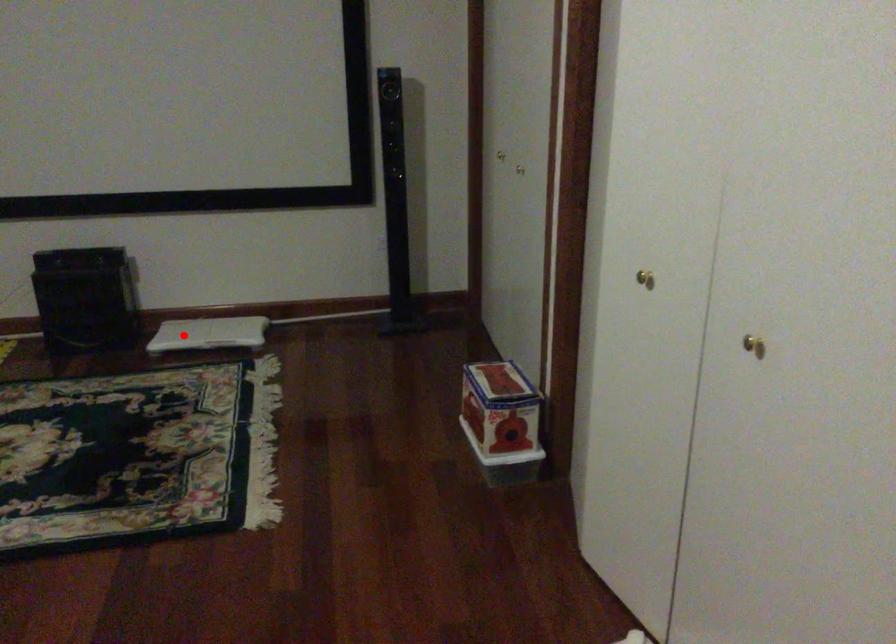
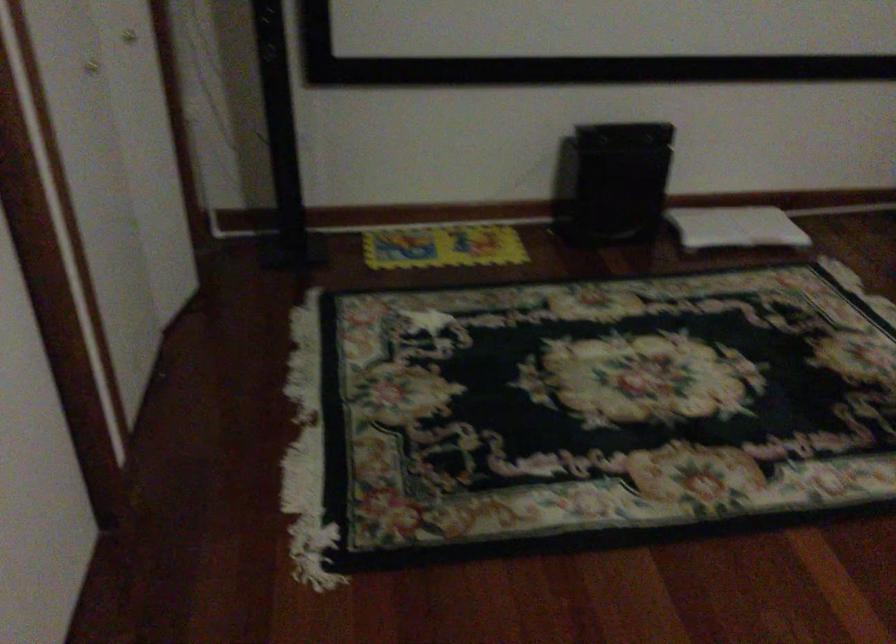
Question: A red point is marked in image1. In image2, is the corresponding 3D point closer to the camera or farther? Reply with the corresponding letter.

Choices:
 (A) The corresponding 3D point is closer.
 (B) The corresponding 3D point is farther.

Answer: (A)